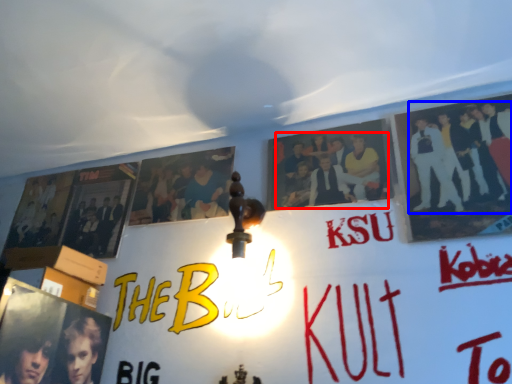
Question: Which object appears farthest to the camera in this image, person (highlighted by a red box) or person (highlighted by a blue box)?

Choices:
 (A) person
 (B) person

Answer: (A)